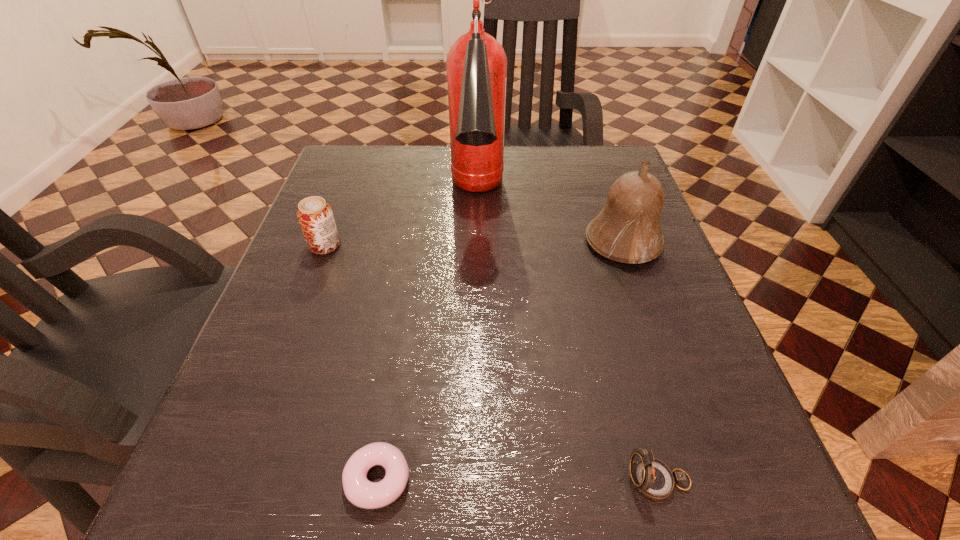
What are the coordinates of `object that stands as the closest to the tallest object` in the screenshot? It's located at (627, 229).

The width and height of the screenshot is (960, 540). Identify the location of vacant space that satisfies the following two spatial constraints: 1. on the back side of the fourth shortest object; 2. on the left side of the doughnut. (416, 242).